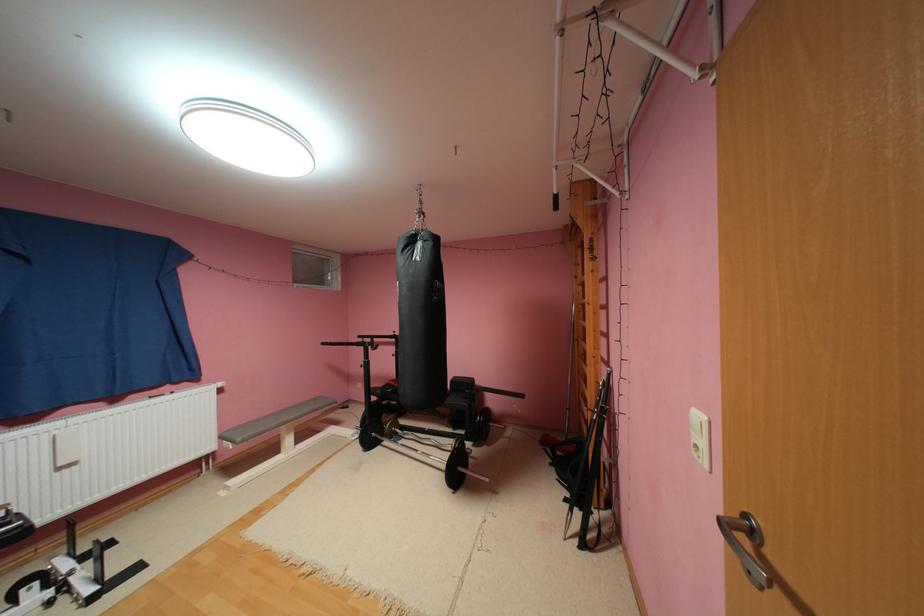
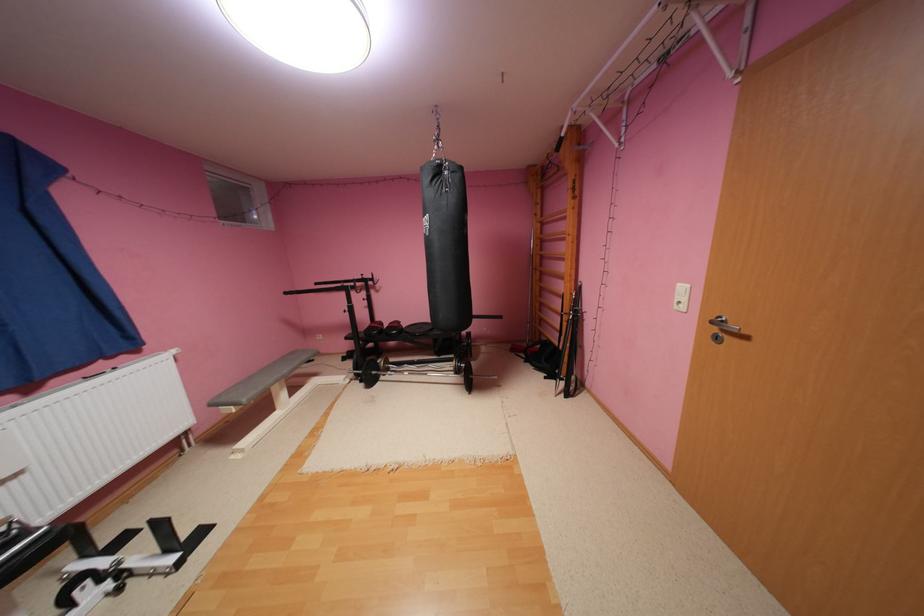
In the second image, find the point that corresponds to (237,434) in the first image.

(233, 399)